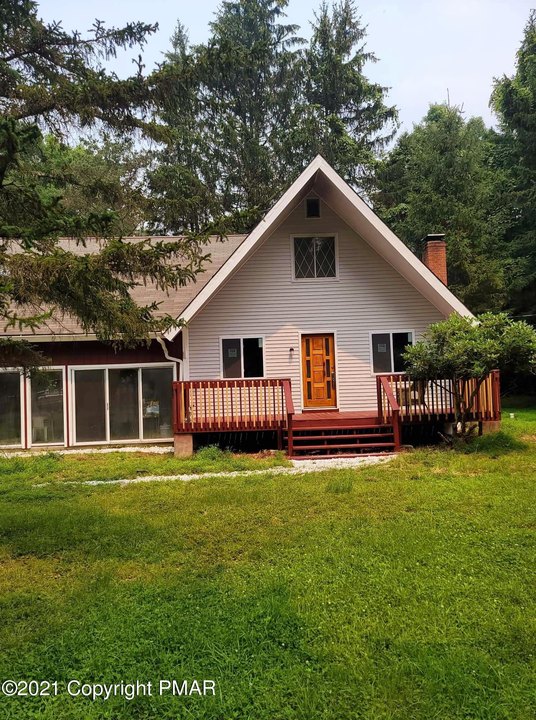
The image size is (536, 720). I want to click on door, so click(x=316, y=387).